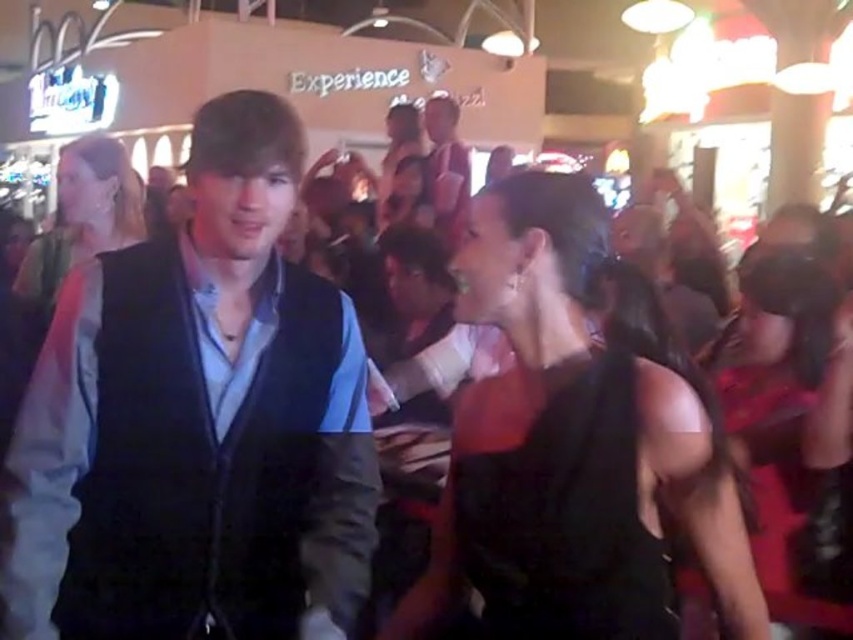
Question: Can you confirm if black satin dress at center is smaller than matte black dress at center?

Choices:
 (A) yes
 (B) no

Answer: (B)

Question: Considering the relative positions of black satin dress at center and matte black dress at center in the image provided, where is black satin dress at center located with respect to matte black dress at center?

Choices:
 (A) left
 (B) right

Answer: (B)

Question: Which of these objects is positioned closest to the dark blue vest at center?

Choices:
 (A) black satin dress at center
 (B) black satin dress at lower right

Answer: (A)

Question: Which of the following is the farthest from the observer?

Choices:
 (A) dark blue vest at center
 (B) black satin dress at lower right

Answer: (B)

Question: Does dark blue vest at center lie behind matte black vest at center?

Choices:
 (A) yes
 (B) no

Answer: (B)

Question: Among these points, which one is nearest to the camera?

Choices:
 (A) (729, 612)
 (B) (138, 538)
 (C) (113, 145)

Answer: (A)